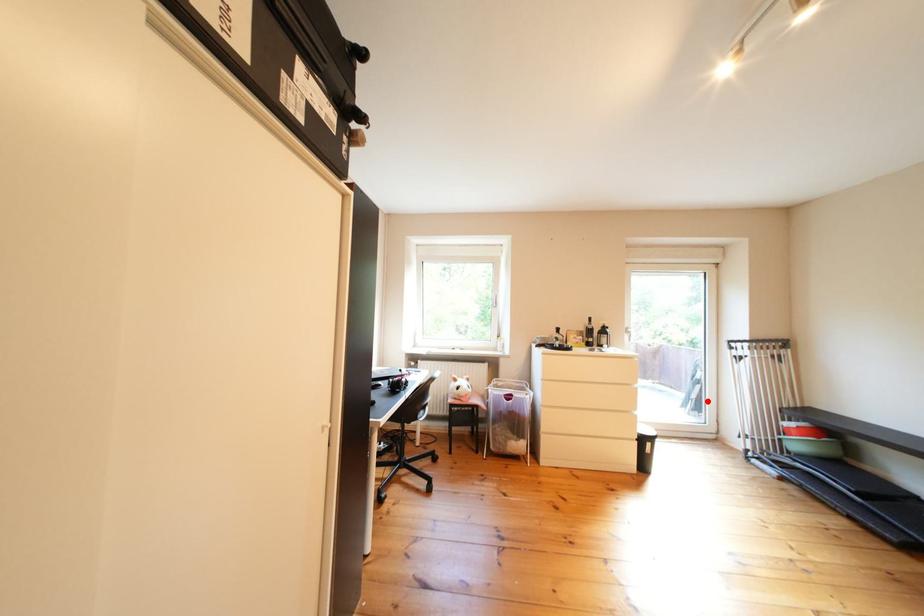
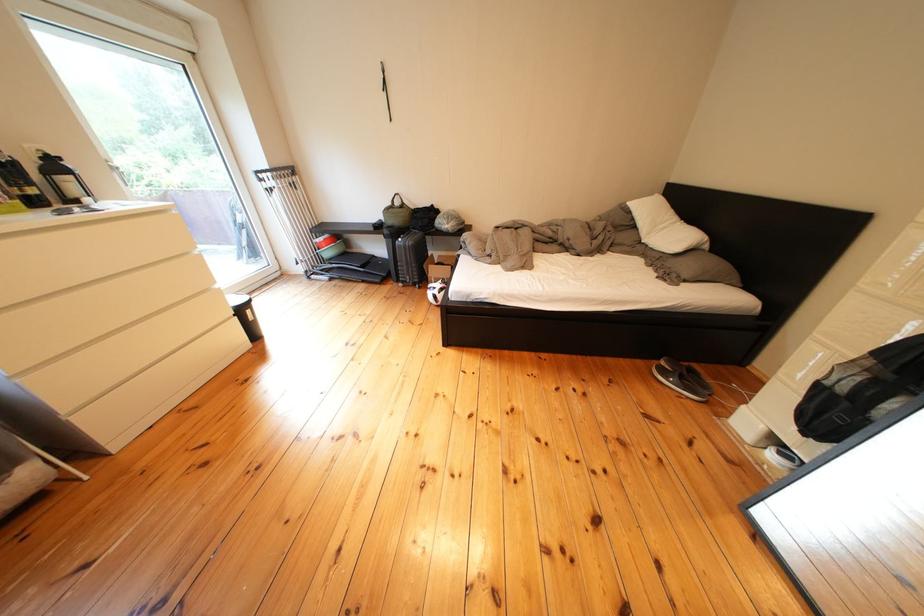
The point at the highlighted location is marked in the first image. Where is the corresponding point in the second image?

(259, 248)